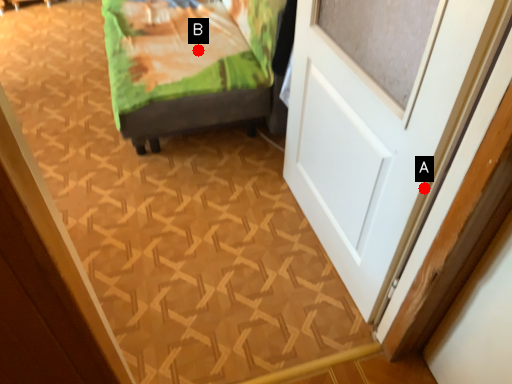
Question: Two points are circled on the image, labeled by A and B beside each circle. Among these points, which one is nearest to the camera?

Choices:
 (A) A is closer
 (B) B is closer

Answer: (A)